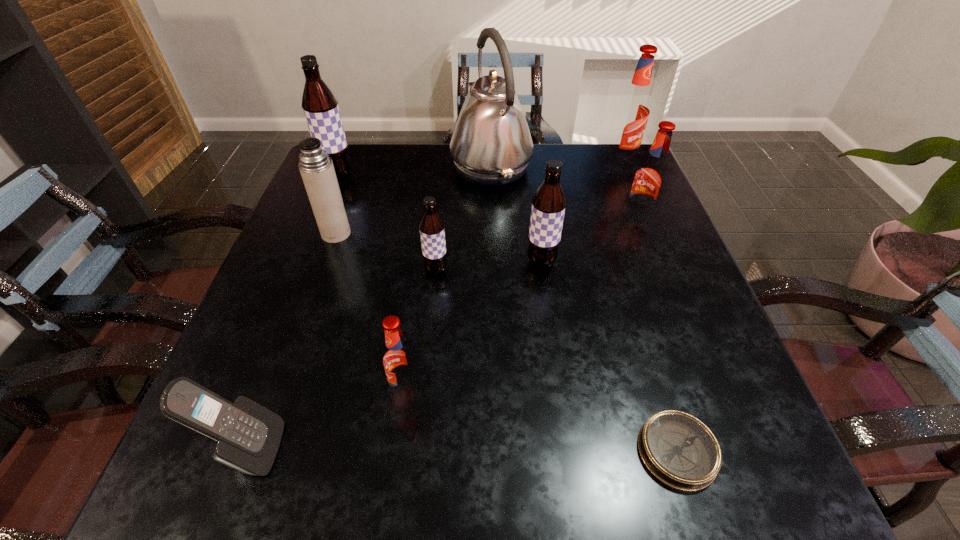
At what (x,y) coordinates should I click in order to perform the action: click on object that is the ninth nearest to the smallest brown root beer. Please return your answer as a coordinate pair (x, y). The image size is (960, 540). Looking at the image, I should click on (633, 109).

This screenshot has width=960, height=540. I want to click on root beer that is the fourth closest one to the shortest object, so click(650, 178).

Locate which root beer ranks in proximity to the kettle. Please provide its 2D coordinates. Your answer should be formatted as a tuple, i.e. [(x, y)], where the tuple contains the x and y coordinates of a point satisfying the conditions above.

[(549, 202)]

Find the location of a particular element. The width and height of the screenshot is (960, 540). the closest brown root beer to the thermos bottle is located at coordinates (320, 105).

Select which brown root beer is the second closest to the rightmost brown root beer. Please provide its 2D coordinates. Your answer should be formatted as a tuple, i.e. [(x, y)], where the tuple contains the x and y coordinates of a point satisfying the conditions above.

[(320, 105)]

Choose which red root beer is the second nearest neighbor to the rightmost brown root beer. Please provide its 2D coordinates. Your answer should be formatted as a tuple, i.e. [(x, y)], where the tuple contains the x and y coordinates of a point satisfying the conditions above.

[(399, 360)]

Where is `red root beer that is the second closest one to the second smallest brown root beer`? red root beer that is the second closest one to the second smallest brown root beer is located at coordinates (399, 360).

Find the location of `free location that satisfies the following two spatial constraints: 1. on the front side of the thermos bottle; 2. on the right side of the second biggest brown root beer`. free location that satisfies the following two spatial constraints: 1. on the front side of the thermos bottle; 2. on the right side of the second biggest brown root beer is located at coordinates (326, 261).

Where is `vacant space that satisfies the following two spatial constraints: 1. on the front-facing side of the cellular telephone; 2. on the right side of the shortest object`? vacant space that satisfies the following two spatial constraints: 1. on the front-facing side of the cellular telephone; 2. on the right side of the shortest object is located at coordinates tap(248, 451).

Locate an element on the screen. free location that satisfies the following two spatial constraints: 1. on the back side of the farthest red root beer; 2. on the left side of the thermos bottle is located at coordinates (362, 161).